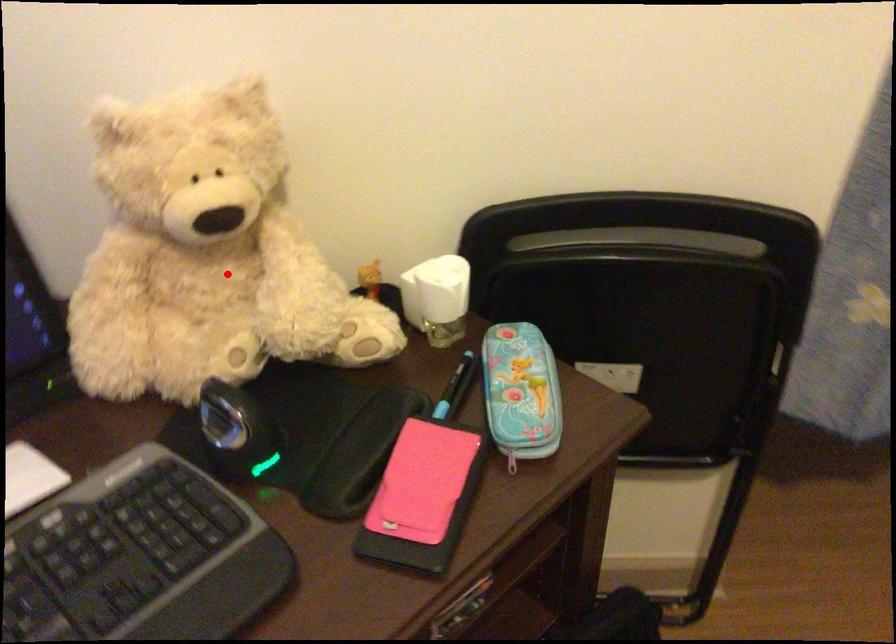
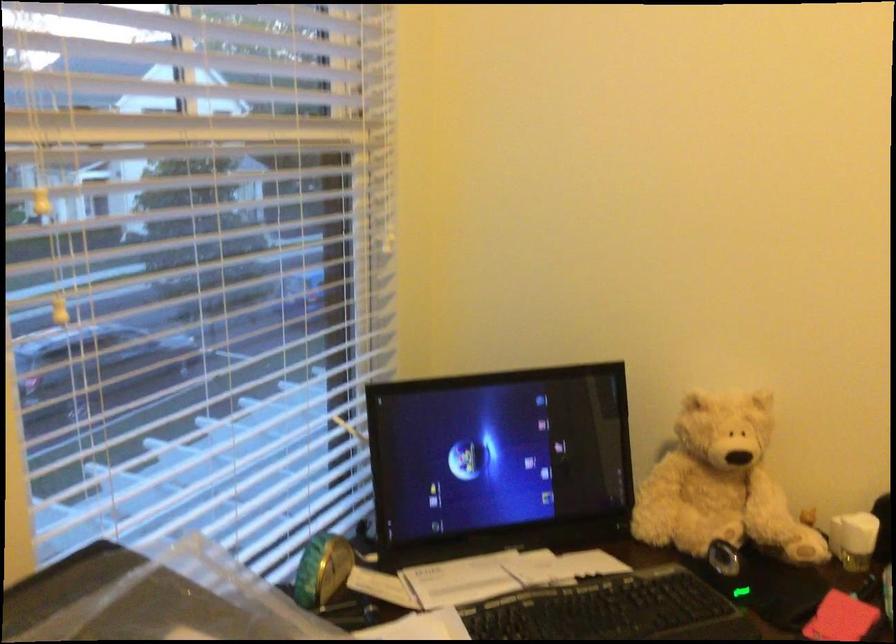
Where in the second image is the point corresponding to the highlighted location from the first image?

(720, 484)